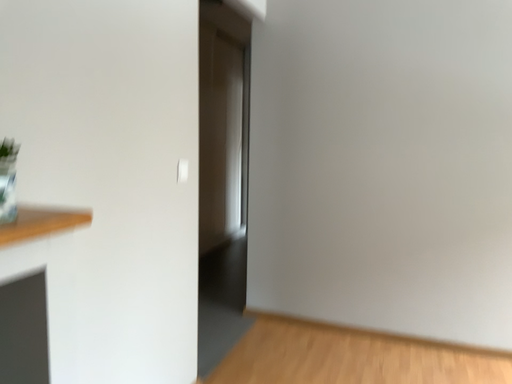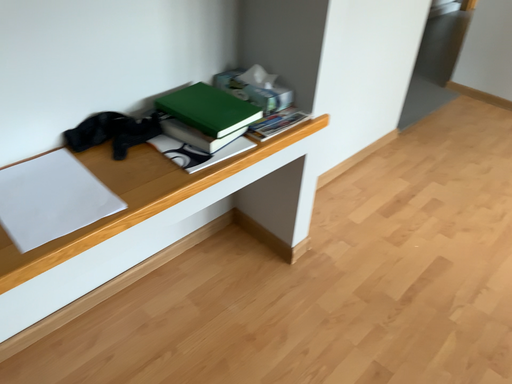
Question: How did the camera likely rotate when shooting the video?

Choices:
 (A) rotated upward
 (B) rotated downward

Answer: (B)